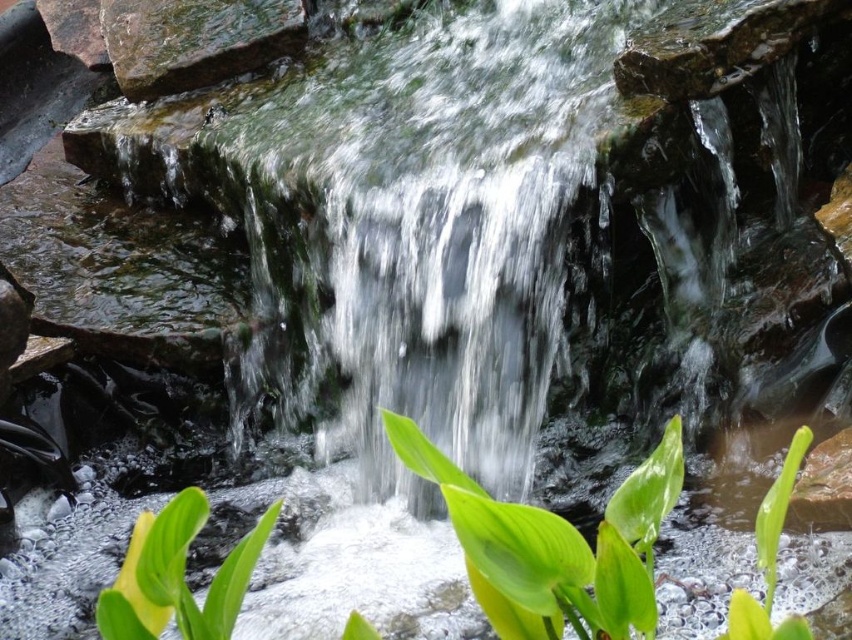
Is point (597, 556) positioned after point (187, 589)?

No, it is not.

Identify the location of green glossy leaf at center. This screenshot has width=852, height=640. click(554, 545).

Locate an element on the screen. This screenshot has height=640, width=852. green glossy leaf at center is located at coordinates (554, 545).

Who is more forward, [639,531] or [757,557]?

Point [639,531] is in front.

Does green glossy leaf at center appear under green leafy plant at lower right?

Incorrect, green glossy leaf at center is not positioned below green leafy plant at lower right.

In the scene shown: Who is more distant from viewer, (669, 444) or (750, 630)?

The point (669, 444) is more distant.

The image size is (852, 640). In order to click on green glossy leaf at center in this screenshot , I will do `click(554, 545)`.

Who is shorter, green leafy plant at lower center or green leafy plant at lower right?

With less height is green leafy plant at lower center.

Is green leafy plant at lower center to the right of green leafy plant at lower right from the viewer's perspective?

Incorrect, green leafy plant at lower center is not on the right side of green leafy plant at lower right.

Which is in front, point (131, 560) or point (770, 634)?

Point (770, 634) is in front.

Find the location of a particular element. Image resolution: width=852 pixels, height=640 pixels. green leafy plant at lower center is located at coordinates click(177, 576).